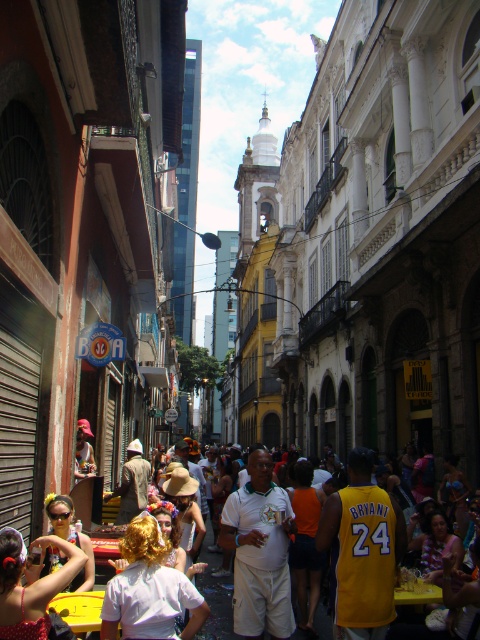
The width and height of the screenshot is (480, 640). What do you see at coordinates (148, 589) in the screenshot?
I see `white matte shirt at center` at bounding box center [148, 589].

This screenshot has height=640, width=480. Describe the element at coordinates (148, 589) in the screenshot. I see `white matte shirt at center` at that location.

The height and width of the screenshot is (640, 480). I want to click on white matte shirt at center, so click(x=148, y=589).

Between white cotton shirt at lower left and matte yellow sunglasses at center, which one has more height?

With more height is matte yellow sunglasses at center.

Does white cotton shirt at lower left have a greater height compared to matte yellow sunglasses at center?

No, white cotton shirt at lower left is not taller than matte yellow sunglasses at center.

What are the coordinates of `white cotton shirt at lower left` in the screenshot? It's located at (29, 586).

Is white cotton shirt at lower left thinner than white cotton shirt at center?

Indeed, white cotton shirt at lower left has a lesser width compared to white cotton shirt at center.

Can you confirm if white cotton shirt at lower left is bigger than white cotton shirt at center?

No.

Between point (22, 602) and point (252, 464), which one is positioned in front?

Positioned in front is point (22, 602).

The height and width of the screenshot is (640, 480). I want to click on white cotton shirt at lower left, so click(x=29, y=586).